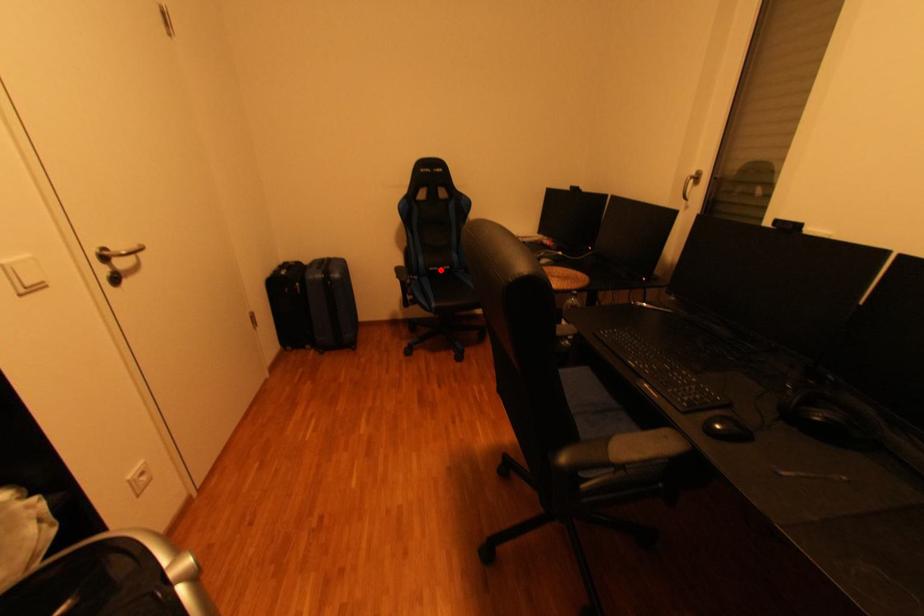
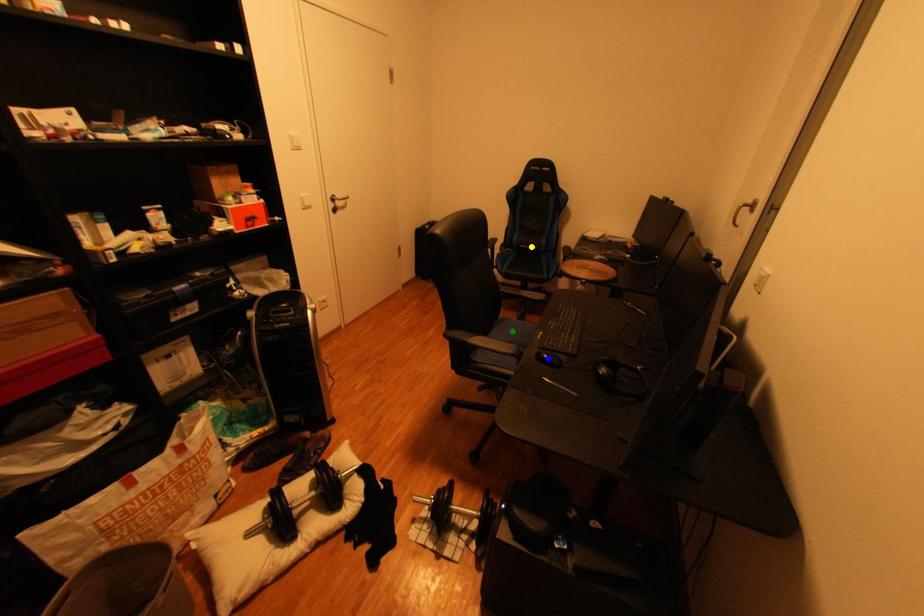
Question: I am providing you with two images of the same scene from different viewpoints. A red point is marked on the first image. You are given multiple points on the second image. Which spot in image 2 lines up with the point in image 1?

Choices:
 (A) green point
 (B) blue point
 (C) yellow point

Answer: (C)